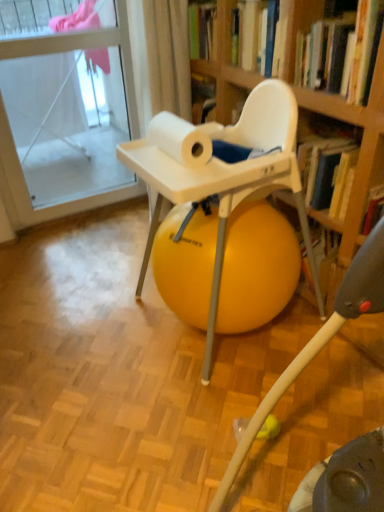
Question: Is transparent glass door at upper left far away from yellow rubber ball at center?

Choices:
 (A) no
 (B) yes

Answer: (B)

Question: Is transparent glass door at upper left positioned before yellow rubber ball at center?

Choices:
 (A) yes
 (B) no

Answer: (B)

Question: From a real-world perspective, is transparent glass door at upper left on yellow rubber ball at center?

Choices:
 (A) no
 (B) yes

Answer: (B)

Question: Can you confirm if transparent glass door at upper left is wider than yellow rubber ball at center?

Choices:
 (A) no
 (B) yes

Answer: (A)

Question: From the image's perspective, is transparent glass door at upper left over yellow rubber ball at center?

Choices:
 (A) yes
 (B) no

Answer: (A)

Question: Is transparent glass door at upper left outside yellow rubber ball at center?

Choices:
 (A) yes
 (B) no

Answer: (A)

Question: Is hardcover book at upper right positioned with its back to white matte paper towel at upper center?

Choices:
 (A) yes
 (B) no

Answer: (B)

Question: From a real-world perspective, is hardcover book at upper right beneath white matte paper towel at upper center?

Choices:
 (A) no
 (B) yes

Answer: (A)

Question: Is hardcover book at upper right at the right side of white matte paper towel at upper center?

Choices:
 (A) yes
 (B) no

Answer: (A)

Question: From the image's perspective, is hardcover book at upper right over white matte paper towel at upper center?

Choices:
 (A) yes
 (B) no

Answer: (A)

Question: Considering the relative sizes of hardcover book at upper right and white matte paper towel at upper center in the image provided, is hardcover book at upper right thinner than white matte paper towel at upper center?

Choices:
 (A) yes
 (B) no

Answer: (B)

Question: Is there a large distance between hardcover book at upper right and white matte paper towel at upper center?

Choices:
 (A) no
 (B) yes

Answer: (A)

Question: Does white matte paper towel at upper center turn towards yellow rubber ball at center?

Choices:
 (A) no
 (B) yes

Answer: (A)